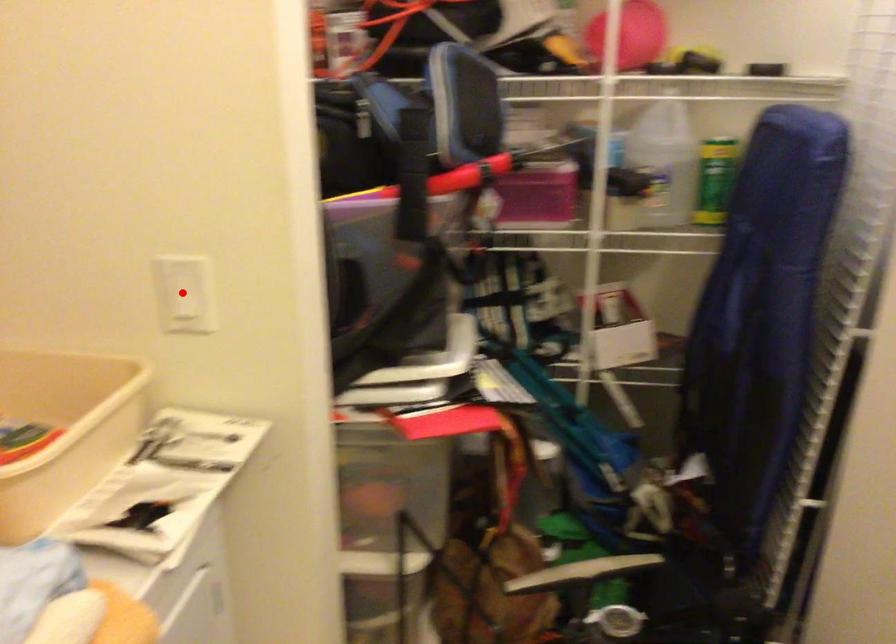
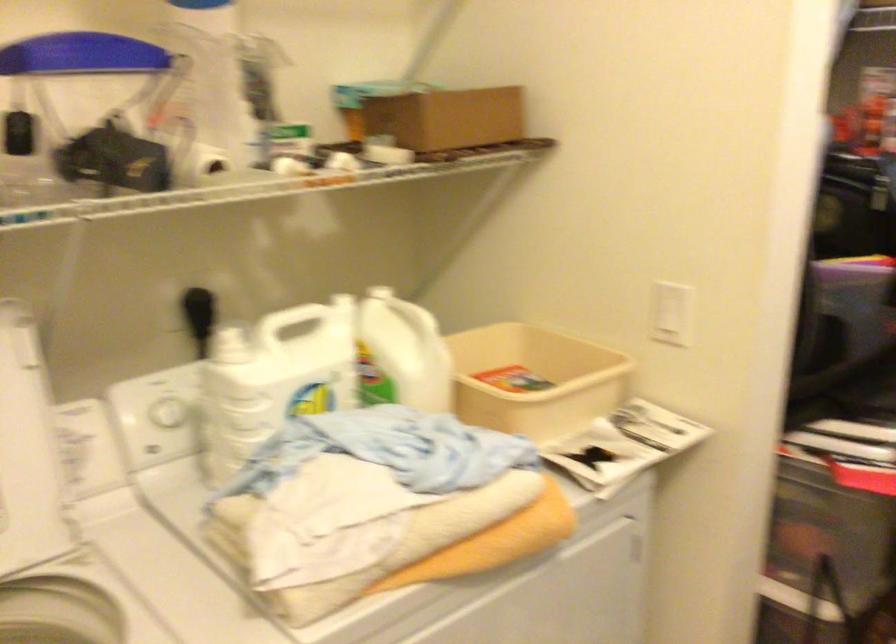
The point at the highlighted location is marked in the first image. Where is the corresponding point in the second image?

(670, 313)